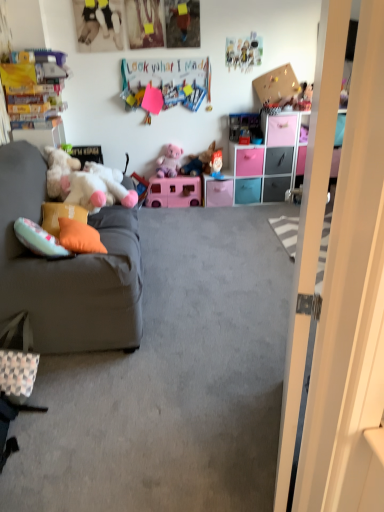
The image size is (384, 512). What are the coordinates of `free spot to the right of checkered fabric bag at lower left` in the screenshot? It's located at (70, 385).